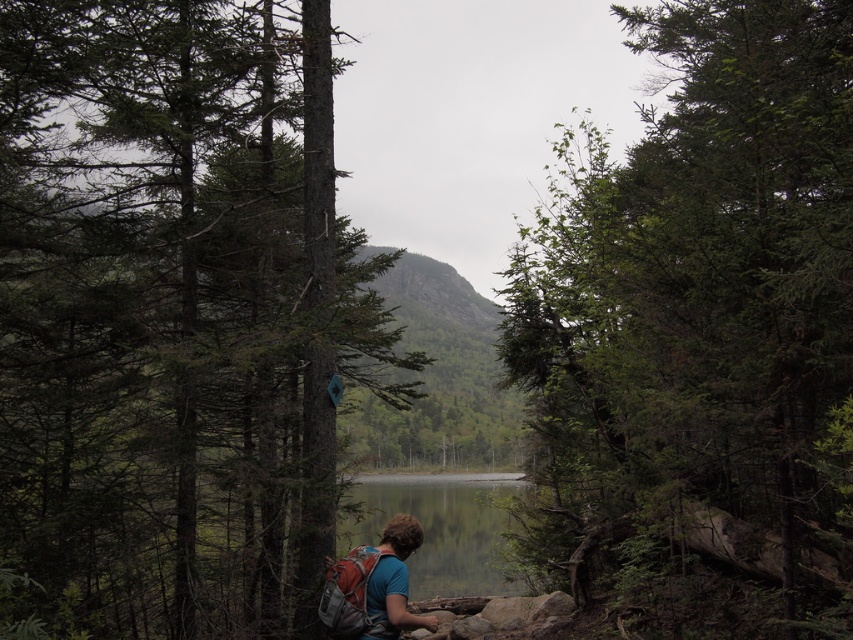
You are a hiker who wants to take a photo of the matte blue shirt at lower center without the green leafy tree at center blocking the view. Is this possible given their positions?

The green leafy tree at center is positioned over the matte blue shirt at lower center, so taking a photo of the matte blue shirt at lower center without the tree blocking the view would not be possible as it is directly above it.

Based on the photo, you are a hiker who wants to take a photo of the green leafy tree at center and the matte blue shirt at lower center. Which object should you focus on first if you want to capture both in sharp focus?

The green leafy tree at center is closer to the viewer than the matte blue shirt at lower center, so you should focus on the green leafy tree at center first to ensure both are in sharp focus.

From the picture: You are a hiker looking for a spot to take a photo of the green matte tree at center and the matte blue shirt at lower center. Based on their positions, which object is positioned to the left of the other?

The green matte tree at center is to the left of the matte blue shirt at lower center.